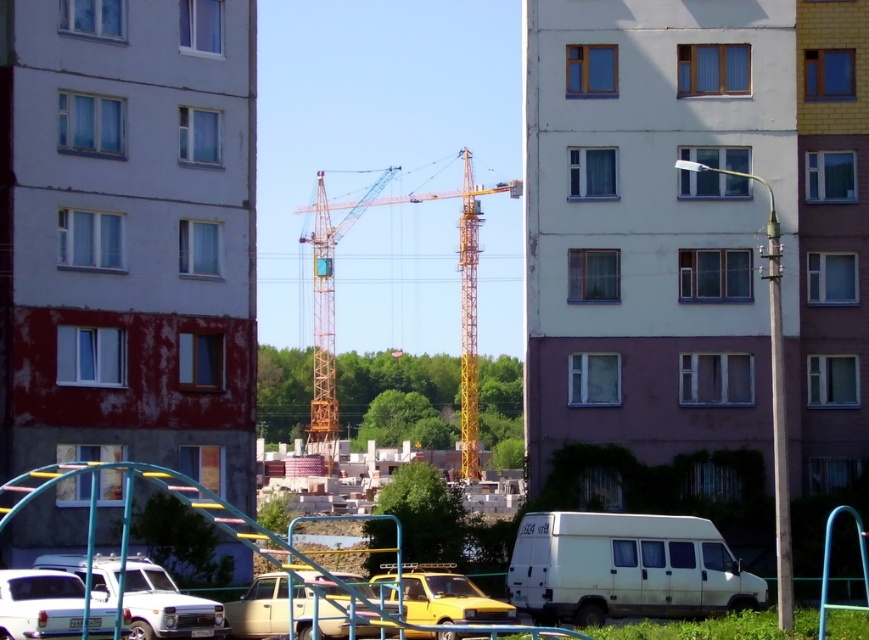
Can you confirm if beige matte car at center is bigger than yellow matte car at center?

Yes.

From the picture: Is the position of beige matte car at center less distant than that of yellow matte car at center?

Yes, beige matte car at center is in front of yellow matte car at center.

Which is behind, point (266, 604) or point (452, 579)?

Point (452, 579)

Image resolution: width=869 pixels, height=640 pixels. I want to click on beige matte car at center, so (x=260, y=609).

At what (x,y) coordinates should I click in order to perform the action: click on white matte car at lower left. Please return your answer as a coordinate pair (x, y). Looking at the image, I should click on (166, 605).

Between point (48, 561) and point (267, 621), which one is positioned behind?

The point (48, 561) is behind.

Locate an element on the screen. white matte car at lower left is located at coordinates (166, 605).

Does point (653, 577) come behind point (70, 577)?

Yes.

How much distance is there between white matte van at lower center and white glossy car at lower left?

15.79 meters

This screenshot has height=640, width=869. I want to click on white matte van at lower center, so click(x=624, y=568).